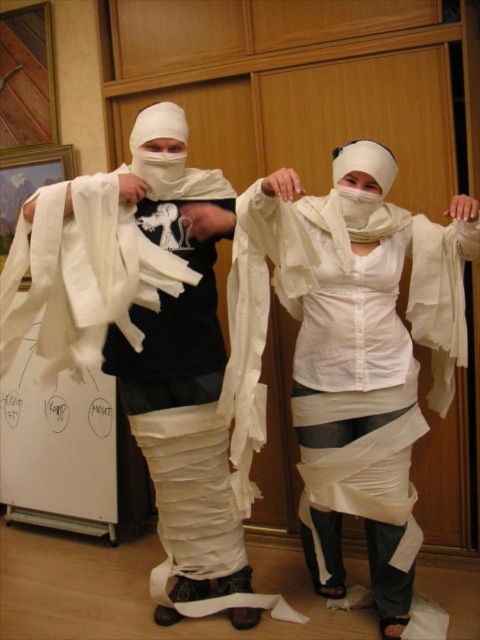
Who is positioned more to the left, white matte toilet paper at center or white paper at center?

white paper at center

Is point (444, 317) behind point (166, 294)?

Yes, it is.

You are a GUI agent. You are given a task and a screenshot of the screen. Output one action in this format:
    pyautogui.click(x=<x>, y=<y>)
    Task: Click on the white matte toilet paper at center
    This screenshot has width=480, height=640.
    Given the screenshot: What is the action you would take?
    pyautogui.click(x=350, y=353)